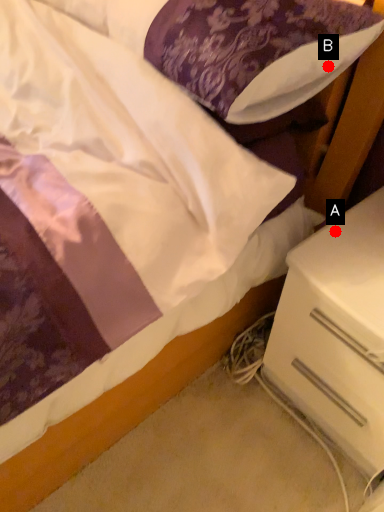
Question: Two points are circled on the image, labeled by A and B beside each circle. Which point is farther to the camera?

Choices:
 (A) A is further
 (B) B is further

Answer: (A)